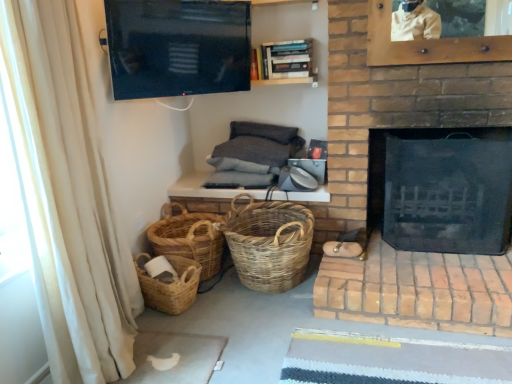
The image size is (512, 384). I want to click on vacant space in front of woven natural basket at center, placed as the first basket when sorted from right to left, so click(x=267, y=337).